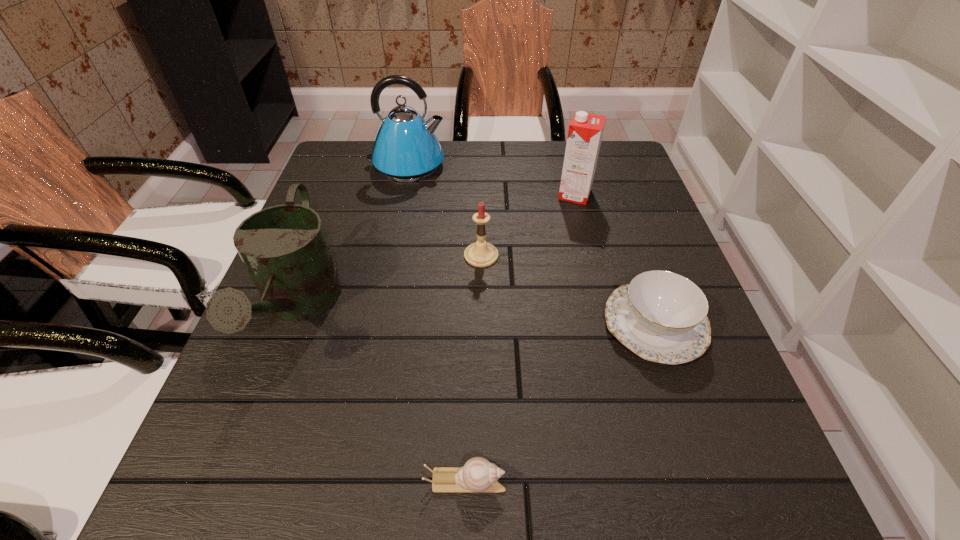
Identify the location of carton that is at the right edge. This screenshot has width=960, height=540. [x=585, y=132].

Where is `chinaware present at the right edge`? The height and width of the screenshot is (540, 960). chinaware present at the right edge is located at coordinates (661, 316).

This screenshot has height=540, width=960. In order to click on object located at the far left corner in this screenshot , I will do `click(406, 149)`.

Where is `object that is at the far right corner`? The width and height of the screenshot is (960, 540). object that is at the far right corner is located at coordinates (585, 132).

The height and width of the screenshot is (540, 960). In the image, there is a desktop. In order to click on free region at the far edge in this screenshot , I will do `click(518, 154)`.

This screenshot has height=540, width=960. In order to click on vacant region at the left edge in this screenshot , I will do `click(294, 359)`.

The width and height of the screenshot is (960, 540). I want to click on vacant space at the right edge, so click(628, 355).

Image resolution: width=960 pixels, height=540 pixels. In order to click on vacant space at the near left corner of the desktop in this screenshot , I will do `click(199, 497)`.

I want to click on blank region between the second shortest object and the escargot, so click(560, 403).

Where is `vacant space that is in between the kettle and the carton`? This screenshot has height=540, width=960. vacant space that is in between the kettle and the carton is located at coordinates (491, 180).